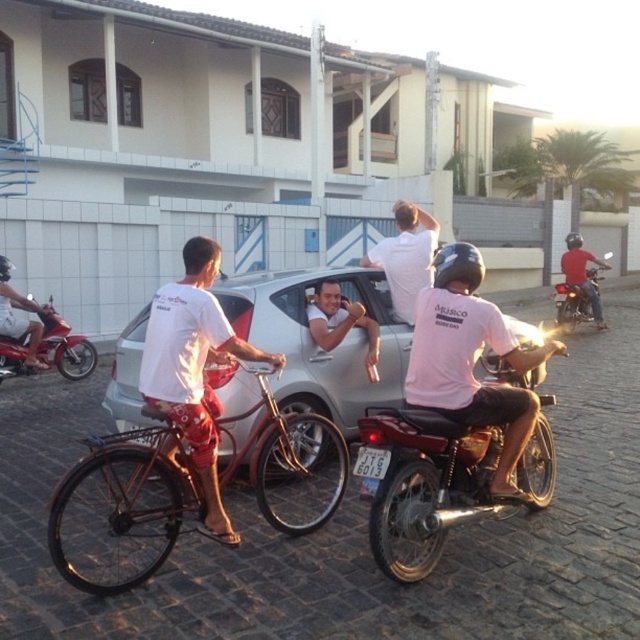
Question: Among these points, which one is farthest from the camera?

Choices:
 (A) (3, 301)
 (B) (400, 275)
 (C) (176, 282)

Answer: (C)

Question: Among these points, which one is nearest to the camera?

Choices:
 (A) (48, 342)
 (B) (432, 307)
 (C) (212, 428)

Answer: (C)

Question: Can you confirm if pink matte helmet at center is positioned below brushed metal motorcycle at center-right?

Choices:
 (A) yes
 (B) no

Answer: (A)

Question: Can you confirm if white matte shorts at center is thinner than metallic red motorcycle at left?

Choices:
 (A) yes
 (B) no

Answer: (B)

Question: Considering the real-world distances, which object is farthest from the white matte shirt at upper center?

Choices:
 (A) matte white car at center
 (B) shiny metallic motorcycle at center
 (C) shiny metallic bicycle at center

Answer: (C)

Question: Does shiny metallic motorcycle at center appear on the right side of metallic red motorcycle at left?

Choices:
 (A) yes
 (B) no

Answer: (A)